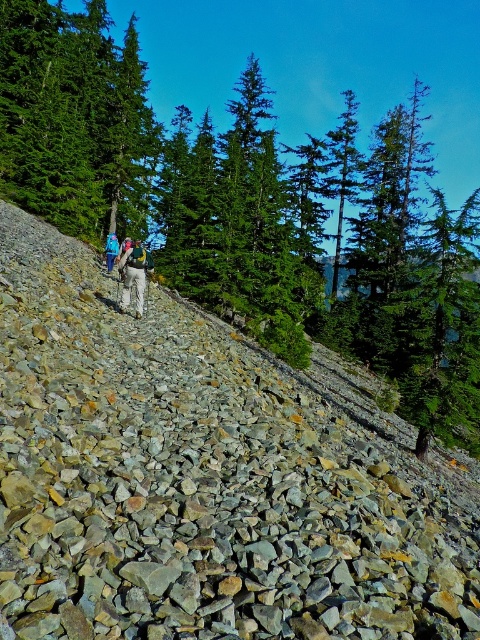
Question: Estimate the real-world distances between objects in this image. Which object is farther from the blue fabric backpack at center?

Choices:
 (A) green evergreen tree at upper center
 (B) green matte tree at upper center

Answer: (A)

Question: Which of these objects is positioned closest to the green matte tree at upper center?

Choices:
 (A) green evergreen tree at upper center
 (B) blue fabric backpack at center
 (C) khaki pants at center

Answer: (B)

Question: Among these points, which one is farthest from the camera?

Choices:
 (A) (117, 244)
 (B) (274, 342)
 (C) (22, 186)

Answer: (C)

Question: Is green matte tree at upper center to the right of blue fabric backpack at center from the viewer's perspective?

Choices:
 (A) yes
 (B) no

Answer: (B)

Question: Does green evergreen tree at upper center appear over blue fabric backpack at center?

Choices:
 (A) yes
 (B) no

Answer: (A)

Question: Does green evergreen tree at upper center lie behind blue fabric backpack at center?

Choices:
 (A) no
 (B) yes

Answer: (A)